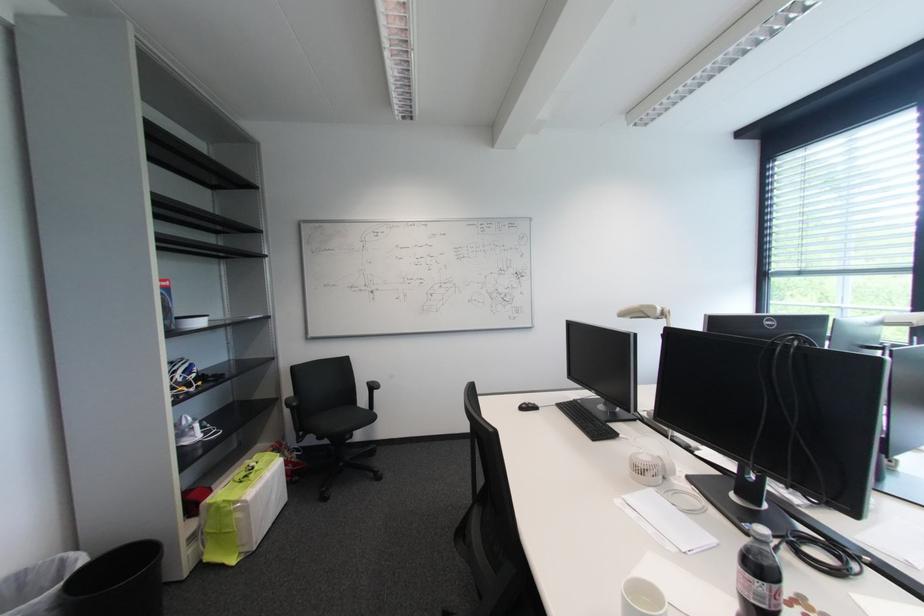
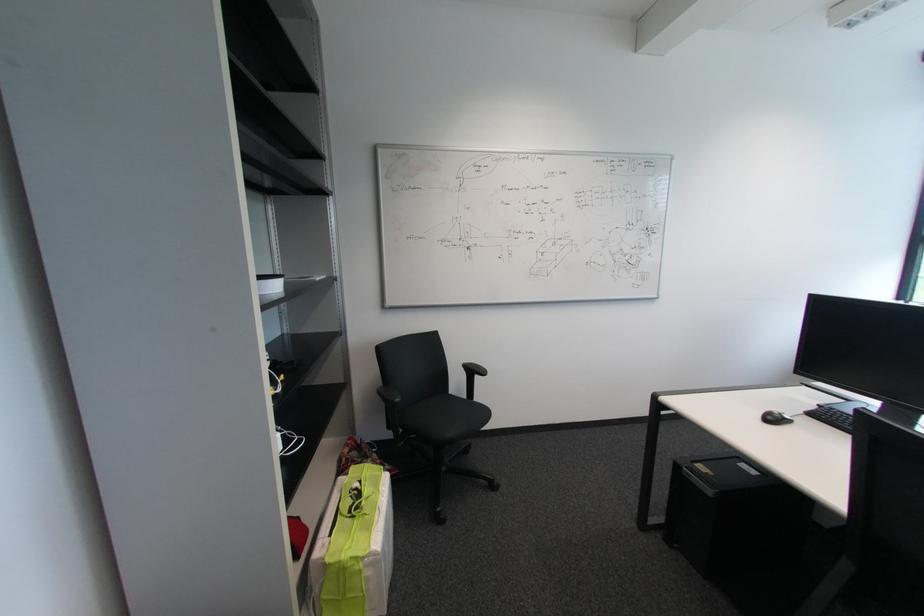
The point at (x=530, y=408) is marked in the first image. Where is the corresponding point in the second image?

(775, 418)